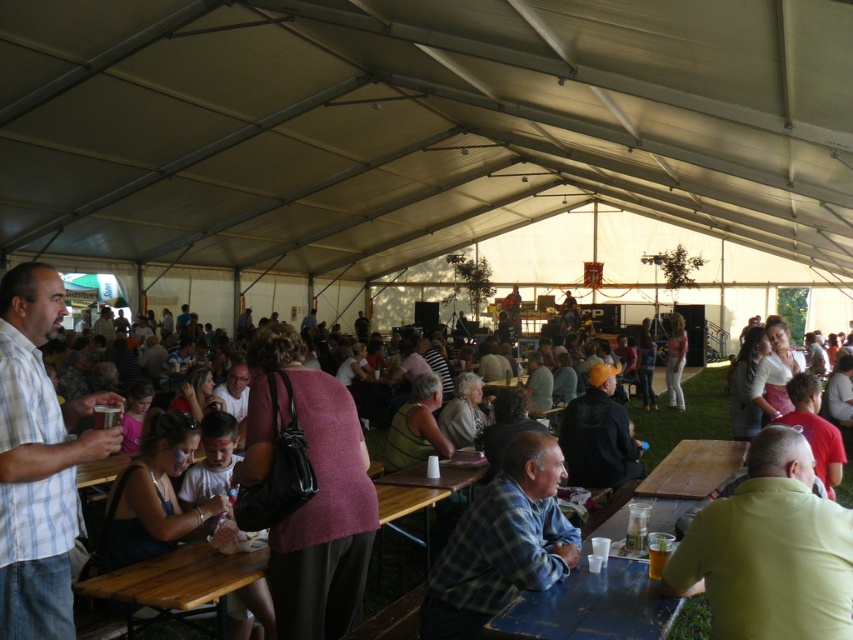
Question: Is yellow matte shirt at lower right to the left of blue wooden table at lower center from the viewer's perspective?

Choices:
 (A) yes
 (B) no

Answer: (B)

Question: Which of these objects is positioned closest to the pink sweater at center?

Choices:
 (A) plaid fabric shirt at lower center
 (B) blue wooden table at lower center
 (C) light pink fabric dress at center
 (D) yellow matte shirt at lower right

Answer: (A)

Question: Does plaid fabric shirt at lower center come behind wooden table at lower left?

Choices:
 (A) no
 (B) yes

Answer: (B)

Question: Among these objects, which one is nearest to the camera?

Choices:
 (A) light pink fabric dress at center
 (B) wooden table at lower center

Answer: (B)

Question: Can you confirm if yellow matte shirt at lower right is wider than light blue plaid shirt at left?

Choices:
 (A) no
 (B) yes

Answer: (B)

Question: Which point appears farthest from the camera in this image?

Choices:
 (A) (840, 573)
 (B) (677, 609)

Answer: (B)